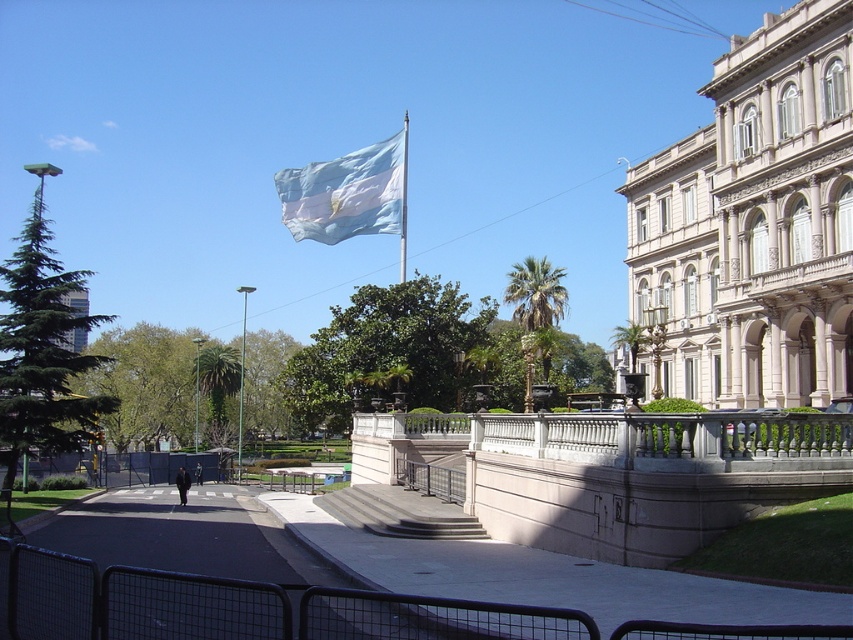
In the scene shown: You are a visitor in the plaza and want to take a photo of both the blue fabric flag at upper center and the white fabric flag at upper center. From your current position, which flag is higher in the frame?

The blue fabric flag at upper center is above the white fabric flag at upper center, so it is higher in the frame.

You are standing at the plaza and want to take a photo of the grand building with the flagpole in the background. If you position yourself at point [401,193], will the flagpole at point [300,170] block your view of the grand building?

Point [300,170] is behind point [401,193], so the flagpole at point [300,170] will not block your view of the grand building when positioned at point [401,193].

You are a photographer planning to capture the grand building with both the blue fabric flag at upper center and the white fabric flag at upper center in the frame. Which flag will appear wider in your photo?

The blue fabric flag at upper center will appear wider in the photo since its width is larger than the white fabric flag at upper center.